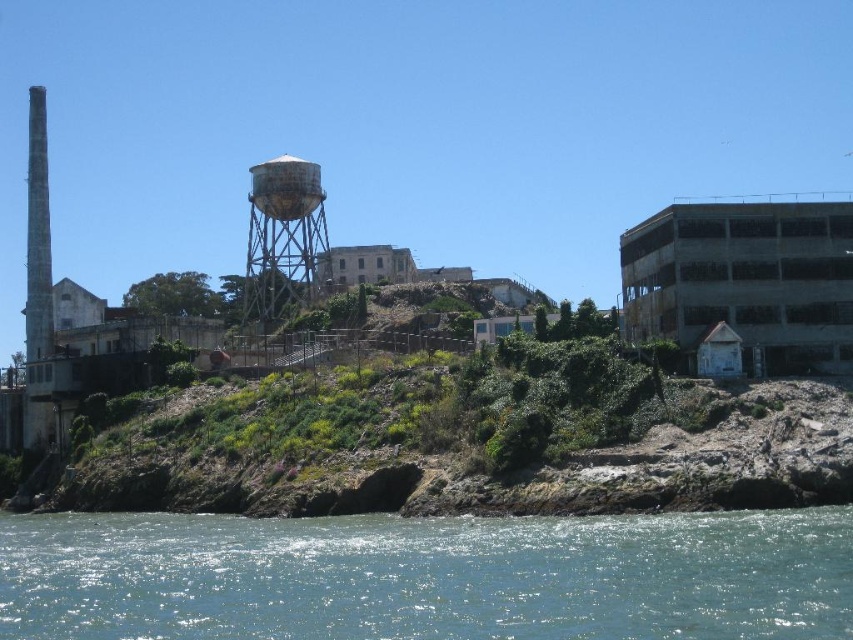
You are a tourist on Alcatraz Island and want to take a photo of the rusty metal water tower at center with the clear blue water at lower left in the background. Based on their positions, will the water tower be fully visible in the photo if you position yourself directly in front of the water tower?

The clear blue water at lower left is located below the rusty metal water tower at center, so if you position yourself directly in front of the rusty metal water tower at center, the water tower will be fully visible in the photo with the water in the background.

Based on the coordinates provided, which object is located at point (427, 577) in the image?

The point (427, 577) corresponds to clear blue water at lower left.

You are a photographer planning to capture the entire view of Alcatraz Island. You have a camera with a wide angle lens that can capture large areas. Which object between the clear blue water at lower left and the rusty metal water tower at center should you focus on to ensure the larger area is in the frame?

The clear blue water at lower left is larger in size than the rusty metal water tower at center, so focusing on the clear blue water at lower left will ensure the larger area is captured in the frame.